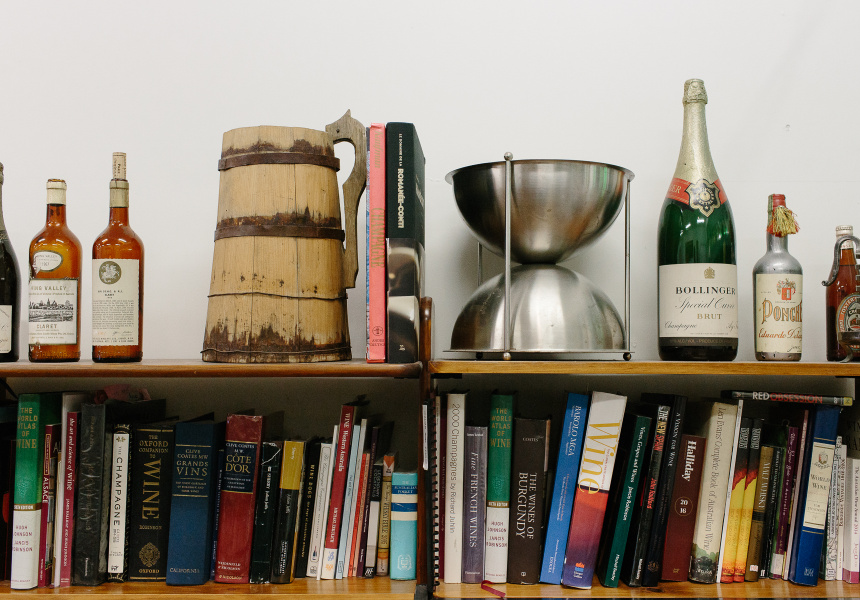
Find the location of `bottom silver bowl reversed`. bottom silver bowl reversed is located at coordinates (547, 313).